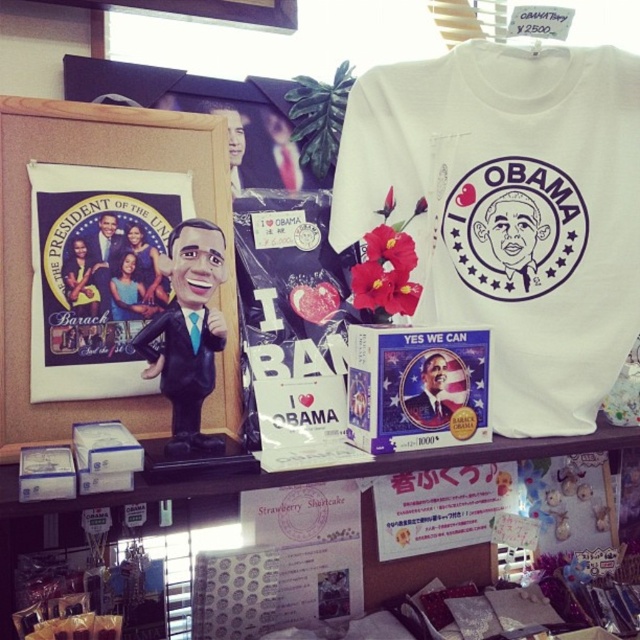
Who is shorter, white cotton t-shirt at upper right or wooden frame at left?

Standing shorter between the two is wooden frame at left.

The image size is (640, 640). Identify the location of white cotton t-shirt at upper right. (509, 211).

Between point (536, 92) and point (28, 140), which one is positioned behind?

The point (536, 92) is more distant.

Find the location of `white cotton t-shirt at upper right`. white cotton t-shirt at upper right is located at coordinates (509, 211).

Is white cotton t-shirt at upper right positioned behind white paper at upper center?

Yes.

Does white cotton t-shirt at upper right have a lesser height compared to white paper at upper center?

Incorrect, white cotton t-shirt at upper right's height does not fall short of white paper at upper center's.

Is point (627, 134) positioned behind point (582, 440)?

Yes, it is.

Locate an element on the screen. This screenshot has width=640, height=640. white cotton t-shirt at upper right is located at coordinates (509, 211).

Who is lower down, wooden frame at left or white paper at upper center?

white paper at upper center

Where is `wooden frame at left`? wooden frame at left is located at coordinates (29, 252).

What do you see at coordinates (29, 252) in the screenshot? I see `wooden frame at left` at bounding box center [29, 252].

The height and width of the screenshot is (640, 640). What are the coordinates of `wooden frame at left` in the screenshot? It's located at (29, 252).